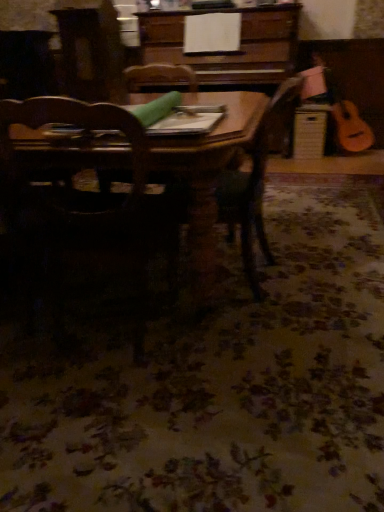
Describe the element at coordinates (84, 192) in the screenshot. Image resolution: width=384 pixels, height=512 pixels. I see `wooden chair at center` at that location.

Locate an element on the screen. The image size is (384, 512). wooden chair at center is located at coordinates pyautogui.click(x=84, y=192).

Where is `wooden chair at center`? wooden chair at center is located at coordinates [84, 192].